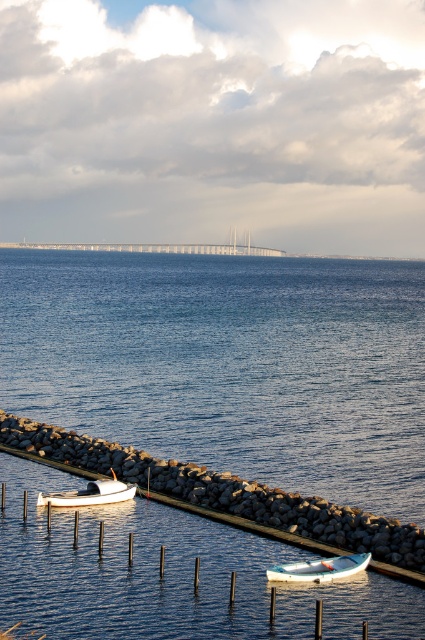
You are standing on the breakwater and want to take a photo of both point [418,429] and point [125,461]. Which point should you focus on first to ensure both are in focus?

You should focus on point [418,429] first because it is closer to you than point [125,461], ensuring both will be in focus when using depth of field.